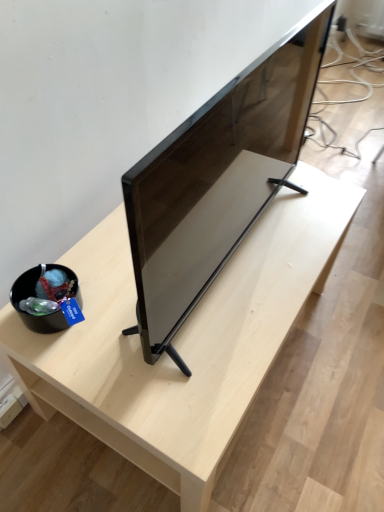
The image size is (384, 512). I want to click on blank space situated above light wood table at center (from a real-world perspective), so click(226, 267).